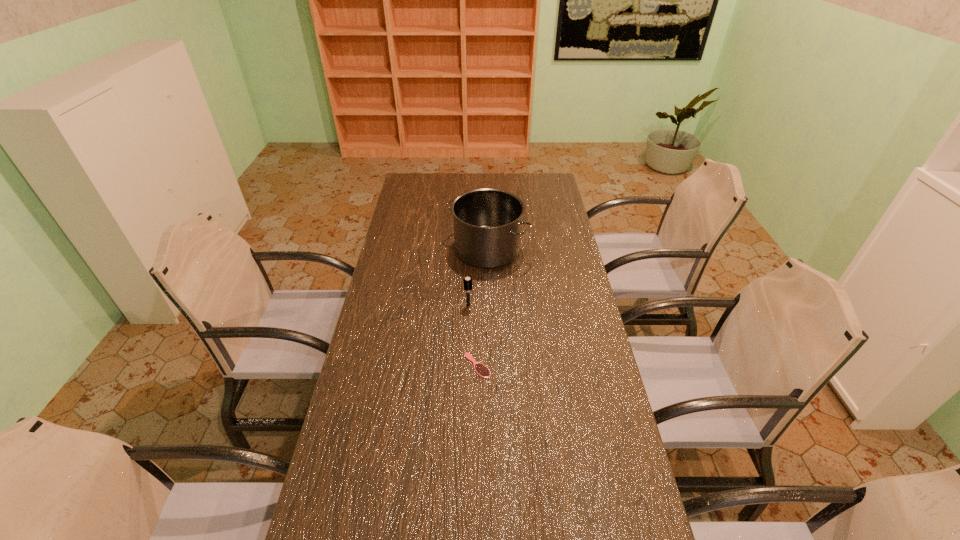
At what (x,y) coordinates should I click in order to perform the action: click on vacant area that lies between the nearer hairbrush and the farthest object. Please return your answer as a coordinate pair (x, y). Looking at the image, I should click on (482, 308).

Find the location of a particular element. Image resolution: width=960 pixels, height=540 pixels. vacant space that is in between the farther hairbrush and the saucepan is located at coordinates (478, 278).

This screenshot has height=540, width=960. What are the coordinates of `free space between the second tallest object and the nearest object` in the screenshot? It's located at (473, 335).

The width and height of the screenshot is (960, 540). In order to click on vacant space that is in between the second tallest object and the saucepan in this screenshot , I will do `click(478, 278)`.

Identify which object is the closest to the farthest object. Please provide its 2D coordinates. Your answer should be formatted as a tuple, i.e. [(x, y)], where the tuple contains the x and y coordinates of a point satisfying the conditions above.

[(467, 281)]

Where is `the second closest object to the shortest object`? This screenshot has width=960, height=540. the second closest object to the shortest object is located at coordinates (487, 222).

Where is `free space in the image that satisfies the following two spatial constraints: 1. on the back side of the farthest object; 2. on the left side of the nearest object`? This screenshot has height=540, width=960. free space in the image that satisfies the following two spatial constraints: 1. on the back side of the farthest object; 2. on the left side of the nearest object is located at coordinates (478, 249).

Where is `free space that satisfies the following two spatial constraints: 1. on the front side of the second tallest object; 2. on the left side of the nearest object`? This screenshot has height=540, width=960. free space that satisfies the following two spatial constraints: 1. on the front side of the second tallest object; 2. on the left side of the nearest object is located at coordinates point(467,366).

The image size is (960, 540). I want to click on free space that satisfies the following two spatial constraints: 1. on the back side of the tallest object; 2. on the right side of the shortest object, so click(x=478, y=249).